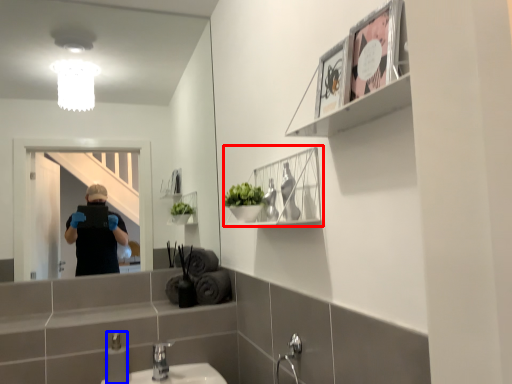
Question: Which object appears farthest to the camera in this image, cabinet (highlighted by a red box) or toiletry (highlighted by a blue box)?

Choices:
 (A) cabinet
 (B) toiletry

Answer: (B)